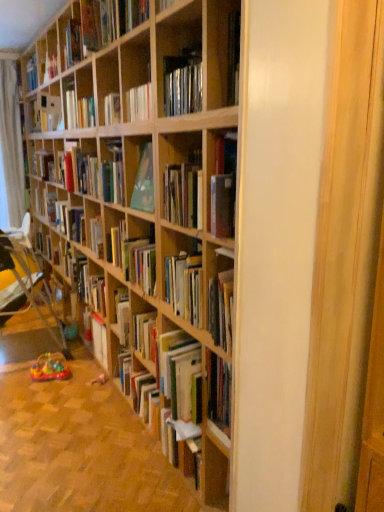
Question: Is matte red book at center, the second book from the top, bigger than plastic multicolored toy at lower left?

Choices:
 (A) yes
 (B) no

Answer: (A)

Question: From the image's perspective, would you say matte red book at center, the second book from the top, is positioned over plastic multicolored toy at lower left?

Choices:
 (A) yes
 (B) no

Answer: (A)

Question: Does matte red book at center, the second book from the top, have a smaller size compared to plastic multicolored toy at lower left?

Choices:
 (A) yes
 (B) no

Answer: (B)

Question: From a real-world perspective, is matte red book at center, which is counted as the 3th book, starting from the bottom, located higher than plastic multicolored toy at lower left?

Choices:
 (A) yes
 (B) no

Answer: (A)

Question: Does matte red book at center, the second book from the top, come behind plastic multicolored toy at lower left?

Choices:
 (A) no
 (B) yes

Answer: (B)

Question: From a real-world perspective, is matte red book at center, the second book from the top, beneath plastic multicolored toy at lower left?

Choices:
 (A) no
 (B) yes

Answer: (A)

Question: Can you confirm if hardcover book at upper left, the fourth book in the bottom-to-top sequence, is thinner than matte red book at center, the second book from the top?

Choices:
 (A) yes
 (B) no

Answer: (B)

Question: From a real-world perspective, is hardcover book at upper left, marked as the first book in a top-to-bottom arrangement, over matte red book at center, which is counted as the 3th book, starting from the bottom?

Choices:
 (A) yes
 (B) no

Answer: (A)

Question: Is matte red book at center, which is counted as the 3th book, starting from the bottom, a part of hardcover book at upper left, marked as the first book in a top-to-bottom arrangement?

Choices:
 (A) no
 (B) yes

Answer: (A)

Question: Can you confirm if hardcover book at upper left, marked as the first book in a top-to-bottom arrangement, is shorter than matte red book at center, the second book from the top?

Choices:
 (A) no
 (B) yes

Answer: (B)

Question: From the image's perspective, is hardcover book at upper left, marked as the first book in a top-to-bottom arrangement, under matte red book at center, which is counted as the 3th book, starting from the bottom?

Choices:
 (A) no
 (B) yes

Answer: (A)

Question: Does hardcover book at upper left, the fourth book in the bottom-to-top sequence, appear on the left side of matte red book at center, the second book from the top?

Choices:
 (A) no
 (B) yes

Answer: (A)

Question: Considering the relative sizes of matte red book at center, the second book from the top, and wooden folding chair at lower left in the image provided, is matte red book at center, the second book from the top, thinner than wooden folding chair at lower left?

Choices:
 (A) no
 (B) yes

Answer: (B)